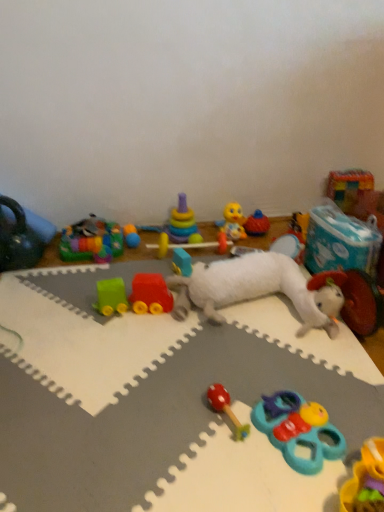
Find the location of `free space in front of multicolored plastic rainbow at upper left, positioned as the 14th toy in right-to-left order`. free space in front of multicolored plastic rainbow at upper left, positioned as the 14th toy in right-to-left order is located at coordinates (89, 274).